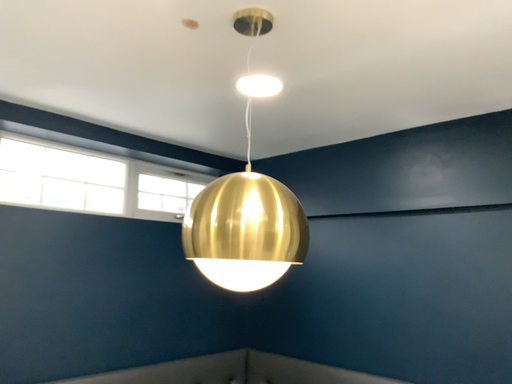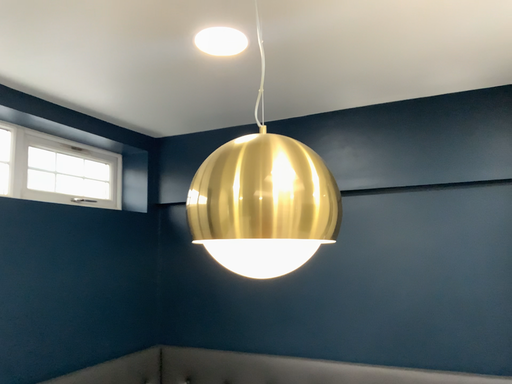
Question: Which way did the camera rotate in the video?

Choices:
 (A) rotated right
 (B) rotated left

Answer: (A)